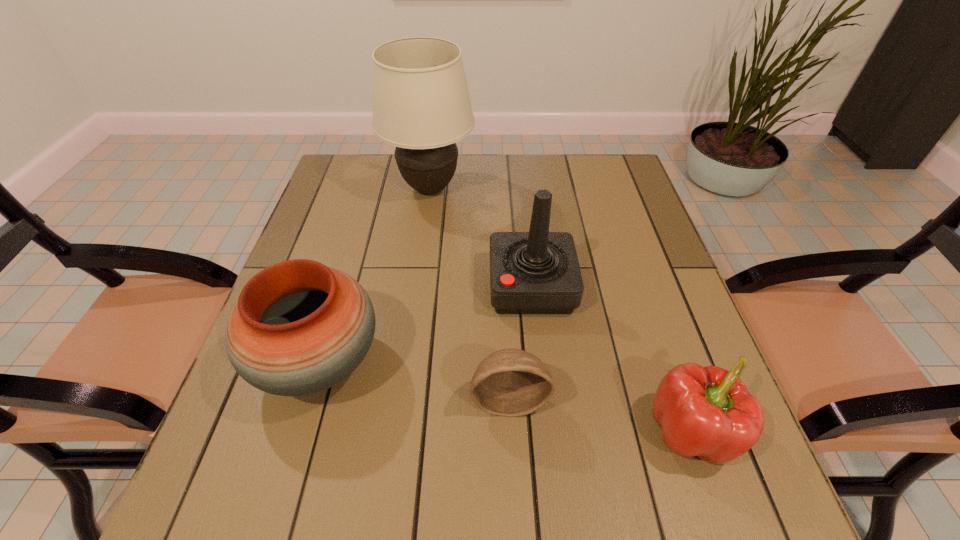
You are a GUI agent. You are given a task and a screenshot of the screen. Output one action in this format:
    pyautogui.click(x=<x>, y=<y>)
    Task: Click on the lampshade
    
    Given the screenshot: What is the action you would take?
    pyautogui.click(x=421, y=104)

At what (x,y) coordinates should I click in order to perform the action: click on the farthest object. Please return your answer as a coordinate pair (x, y). This screenshot has height=540, width=960. Looking at the image, I should click on pyautogui.click(x=421, y=104).

Image resolution: width=960 pixels, height=540 pixels. Find the location of `joystick`. joystick is located at coordinates 537,272.

This screenshot has width=960, height=540. Find the location of `pottery`. pottery is located at coordinates (299, 327).

Find the location of a particular element. This screenshot has width=960, height=540. pepper is located at coordinates (708, 412).

Image resolution: width=960 pixels, height=540 pixels. Identify the location of bowl. (510, 382).

Find the location of `vacant space located on the right of the farthest object`. vacant space located on the right of the farthest object is located at coordinates (509, 188).

You are a GUI agent. You are given a task and a screenshot of the screen. Output one action in this format:
    pyautogui.click(x=<x>, y=<y>)
    Task: Click on the free space located 0.380m on the front-facing side of the fourth shortest object
    Image resolution: width=960 pixels, height=540 pixels.
    Given the screenshot: What is the action you would take?
    pyautogui.click(x=328, y=286)

Where is `vacant space positioned on the front-facing side of the fourth shortest object`? vacant space positioned on the front-facing side of the fourth shortest object is located at coordinates (426, 286).

Image resolution: width=960 pixels, height=540 pixels. In order to click on vacant space situated 0.170m on the front-facing side of the fourth shortest object in this screenshot , I will do `click(418, 286)`.